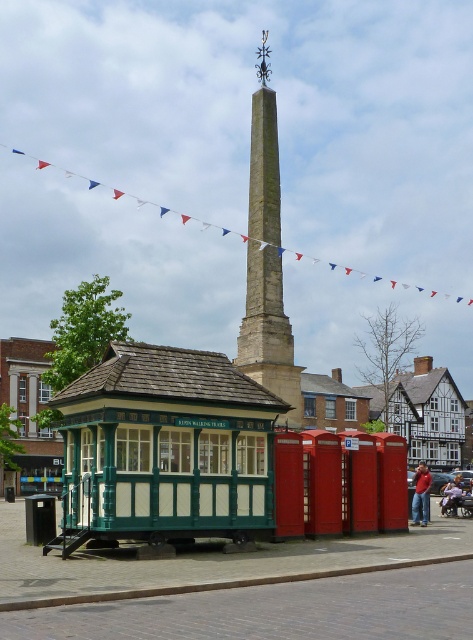
Question: Which of the following is the closest to the observer?

Choices:
 (A) (175, 371)
 (B) (421, 493)
 (C) (300, 416)
 (D) (5, 353)

Answer: (A)

Question: Which point is closer to the camera?

Choices:
 (A) green wood gazebo at center
 (B) green wooden booth at lower left
 (C) smooth stone obelisk at center

Answer: (A)

Question: Does green wood gazebo at center have a lesser width compared to green wooden booth at lower left?

Choices:
 (A) yes
 (B) no

Answer: (A)

Question: Does green wooden booth at lower left come in front of smooth stone obelisk at center?

Choices:
 (A) yes
 (B) no

Answer: (A)

Question: Which of the following is the closest to the observer?

Choices:
 (A) (66, 403)
 (B) (262, 60)
 (C) (329, 385)
 (D) (415, 499)

Answer: (A)

Question: Does green wooden booth at lower left come behind red shirt at center?

Choices:
 (A) no
 (B) yes

Answer: (A)